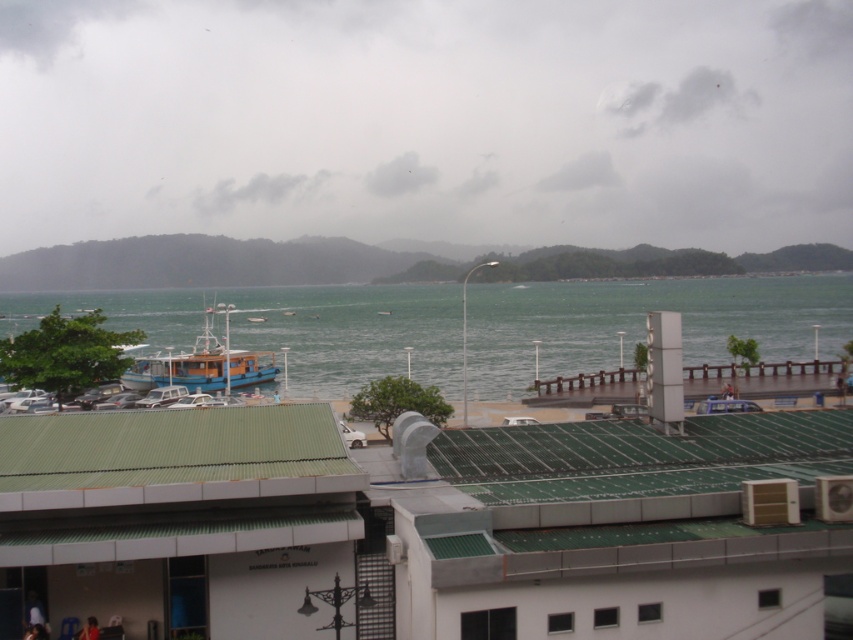
Does blue-green water at center appear on the right side of blue wooden boat at center-left?

Indeed, blue-green water at center is positioned on the right side of blue wooden boat at center-left.

Between blue-green water at center and blue wooden boat at center-left, which one has more height?

Standing taller between the two is blue-green water at center.

Does point (165, 310) come in front of point (181, 372)?

That is False.

Identify the location of blue-green water at center. (643, 323).